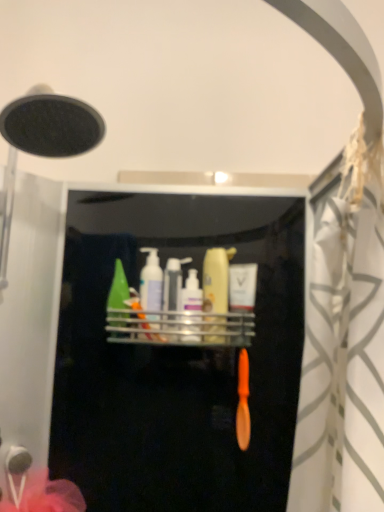
Question: From the image's perspective, does matte yellow bottle at center, which is the 2th toiletry from right to left, appear lower than green matte bottle at center, the first toiletry from the left?

Choices:
 (A) yes
 (B) no

Answer: (B)

Question: From a real-world perspective, is matte yellow bottle at center, which is the 2th toiletry from right to left, beneath green matte bottle at center, the first toiletry from the left?

Choices:
 (A) no
 (B) yes

Answer: (A)

Question: Is matte yellow bottle at center, which is the 4th toiletry from left to right, wider than green matte bottle at center, the 5th toiletry from the right?

Choices:
 (A) yes
 (B) no

Answer: (B)

Question: Considering the relative sizes of matte yellow bottle at center, which is the 2th toiletry from right to left, and green matte bottle at center, the 5th toiletry from the right, in the image provided, is matte yellow bottle at center, which is the 2th toiletry from right to left, taller than green matte bottle at center, the 5th toiletry from the right,?

Choices:
 (A) no
 (B) yes

Answer: (B)

Question: Does matte yellow bottle at center, which is the 2th toiletry from right to left, contain green matte bottle at center, the 5th toiletry from the right?

Choices:
 (A) yes
 (B) no

Answer: (B)

Question: Which is correct: matte yellow bottle at center, which is the 4th toiletry from left to right, is inside green matte bottle at center, the first toiletry from the left, or outside of it?

Choices:
 (A) inside
 (B) outside

Answer: (B)

Question: From the image's perspective, is matte yellow bottle at center, which is the 4th toiletry from left to right, above or below green matte bottle at center, the 5th toiletry from the right?

Choices:
 (A) below
 (B) above

Answer: (B)

Question: Considering the positions of point (213, 305) and point (117, 313), is point (213, 305) closer or farther from the camera than point (117, 313)?

Choices:
 (A) farther
 (B) closer

Answer: (A)

Question: In terms of height, does matte yellow bottle at center, which is the 2th toiletry from right to left, look taller or shorter compared to green matte bottle at center, the 5th toiletry from the right?

Choices:
 (A) tall
 (B) short

Answer: (A)

Question: Considering the positions of matte white lotion at center, which is counted as the first toiletry, starting from the right, and green matte bottle at center, the first toiletry from the left, in the image, is matte white lotion at center, which is counted as the first toiletry, starting from the right, wider or thinner than green matte bottle at center, the first toiletry from the left,?

Choices:
 (A) thin
 (B) wide

Answer: (A)

Question: Is matte white lotion at center, which is counted as the first toiletry, starting from the right, bigger or smaller than green matte bottle at center, the 5th toiletry from the right?

Choices:
 (A) big
 (B) small

Answer: (B)

Question: From the image's perspective, relative to green matte bottle at center, the first toiletry from the left, is matte white lotion at center, which is counted as the first toiletry, starting from the right, above or below?

Choices:
 (A) above
 (B) below

Answer: (B)

Question: Considering the positions of point (244, 274) and point (117, 320), is point (244, 274) closer or farther from the camera than point (117, 320)?

Choices:
 (A) farther
 (B) closer

Answer: (A)

Question: Considering the positions of green matte bottle at center, the first toiletry from the left, and translucent plastic bottle at center, placed as the 3th toiletry when sorted from left to right, in the image, is green matte bottle at center, the first toiletry from the left, taller or shorter than translucent plastic bottle at center, placed as the 3th toiletry when sorted from left to right,?

Choices:
 (A) short
 (B) tall

Answer: (B)

Question: From a real-world perspective, is green matte bottle at center, the 5th toiletry from the right, positioned above or below translucent plastic bottle at center, placed as the 3th toiletry when sorted from left to right?

Choices:
 (A) above
 (B) below

Answer: (A)